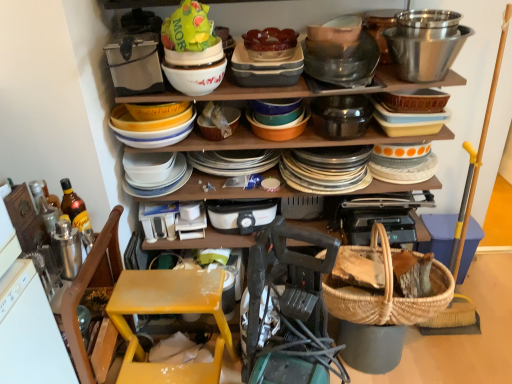
Question: Is woven straw basket at center, which is the 2th basket from back to front, in front of or behind translucent amber glass bottle at left in the image?

Choices:
 (A) behind
 (B) front

Answer: (A)

Question: From a real-world perspective, is woven straw basket at center, which is the 2th basket from back to front, positioned above or below translucent amber glass bottle at left?

Choices:
 (A) above
 (B) below

Answer: (A)

Question: Estimate the real-world distances between objects in this image. Which object is closer to the woven wicker basket at lower right?

Choices:
 (A) yellow matte bowls at center, positioned as the 1th bowl in left-to-right order
 (B) yellow plastic step stool at lower left
 (C) metallic silver toaster at upper left, acting as the second appliance starting from the back
 (D) translucent amber glass bottle at left
 (E) green plastic bag at upper center

Answer: (B)

Question: Which object is the closest to the white glossy bowl at upper center, the 2th bowl from the left?

Choices:
 (A) yellow matte bowls at center, positioned as the 1th bowl in left-to-right order
 (B) black plastic toaster at center, positioned as the first appliance in back-to-front order
 (C) translucent glass bowl at upper center
 (D) woven straw basket at lower center, which appears as the 2th basket when viewed from the front
 (E) yellow plastic step stool at lower left

Answer: (A)